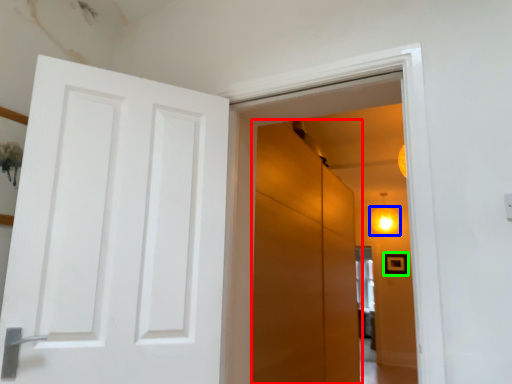
Question: Which is nearer to the screen door (highlighted by a red box)? lighting (highlighted by a blue box) or picture frame (highlighted by a green box).

Choices:
 (A) lighting
 (B) picture frame

Answer: (A)